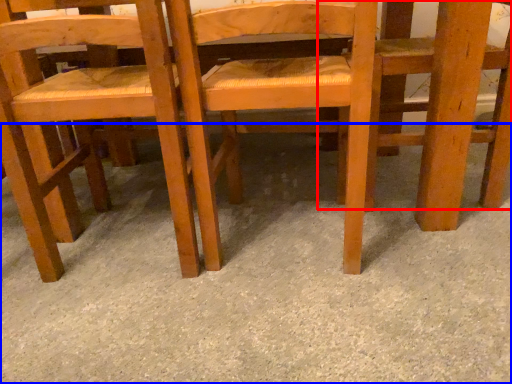
Question: Which object is closer to the camera taking this photo, chair (highlighted by a red box) or concrete (highlighted by a blue box)?

Choices:
 (A) chair
 (B) concrete

Answer: (B)